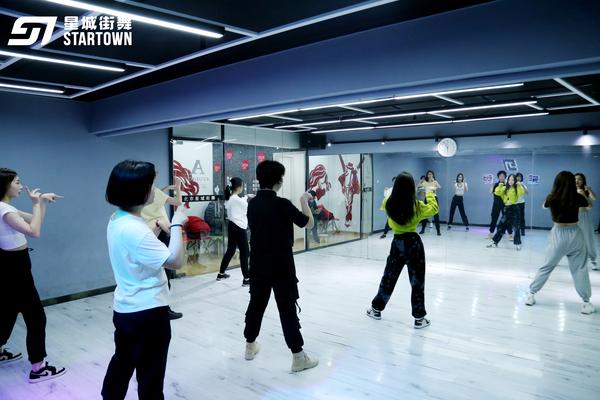
The height and width of the screenshot is (400, 600). What are the coordinates of `baseboard` in the screenshot? It's located at (93, 290).